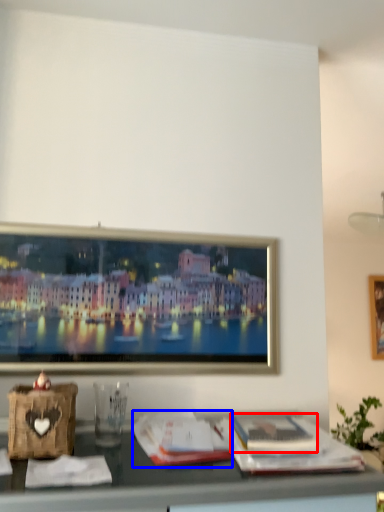
Question: Which object is further to the camera taking this photo, magazine (highlighted by a red box) or magazine (highlighted by a blue box)?

Choices:
 (A) magazine
 (B) magazine

Answer: (A)